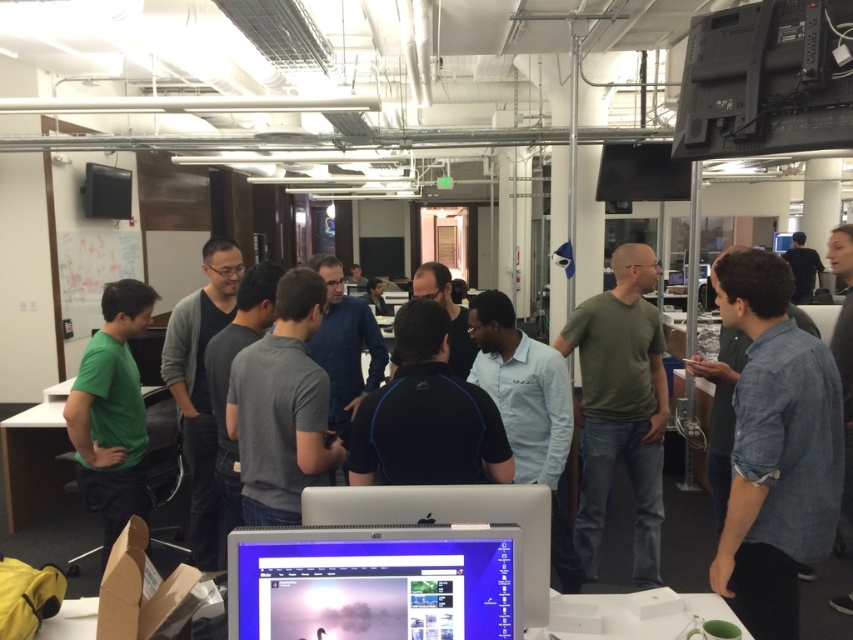
Question: Can you confirm if green matte shirt at center is smaller than black matte shirt at center?

Choices:
 (A) no
 (B) yes

Answer: (A)

Question: Is the position of green matte shirt at left more distant than that of matte black shirt at center?

Choices:
 (A) no
 (B) yes

Answer: (A)

Question: Which point is farther to the camera?

Choices:
 (A) (567, 340)
 (B) (805, 269)
 (C) (451, 545)
 (D) (68, 404)

Answer: (B)

Question: Which of the following is the closest to the observer?

Choices:
 (A) (804, 243)
 (B) (370, 292)
 (C) (631, 406)

Answer: (C)

Question: Considering the relative positions of gray matte shirt at center and matte black shirt at center in the image provided, where is gray matte shirt at center located with respect to matte black shirt at center?

Choices:
 (A) above
 (B) below

Answer: (B)

Question: Estimate the real-world distances between objects in this image. Which object is farther from the green matte shirt at center?

Choices:
 (A) matte black monitor at center
 (B) black matte shirt at center

Answer: (A)